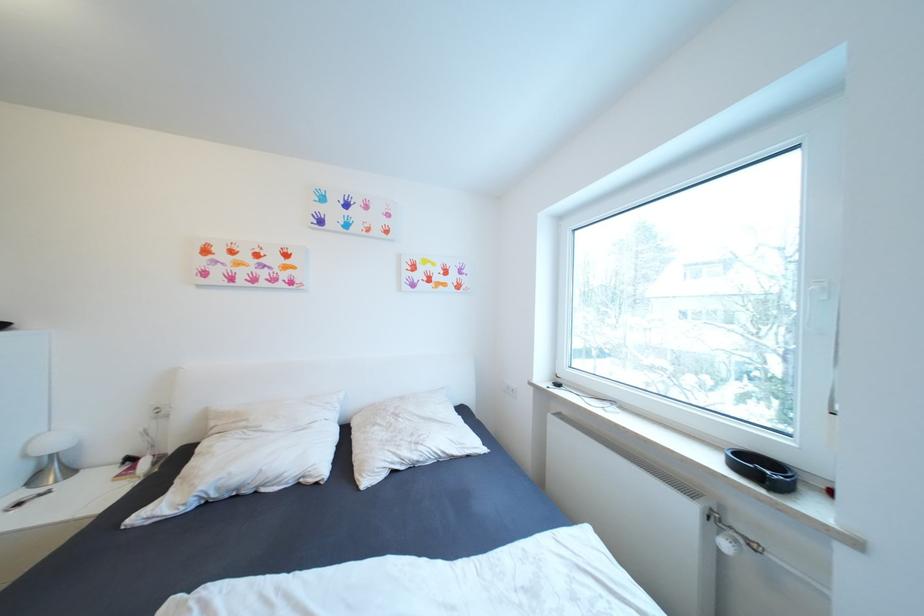
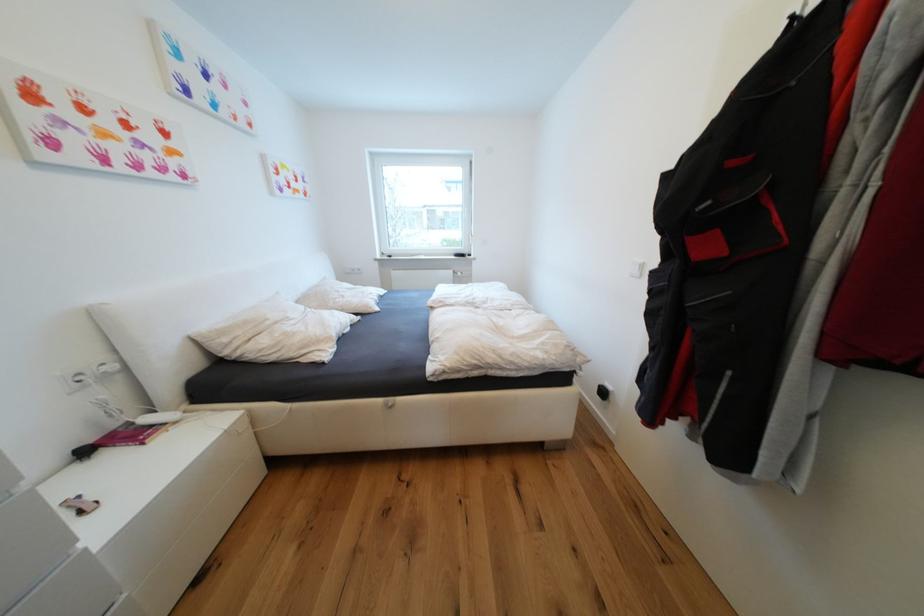
The point at (x=220, y=424) is marked in the first image. Where is the corresponding point in the second image?

(233, 341)